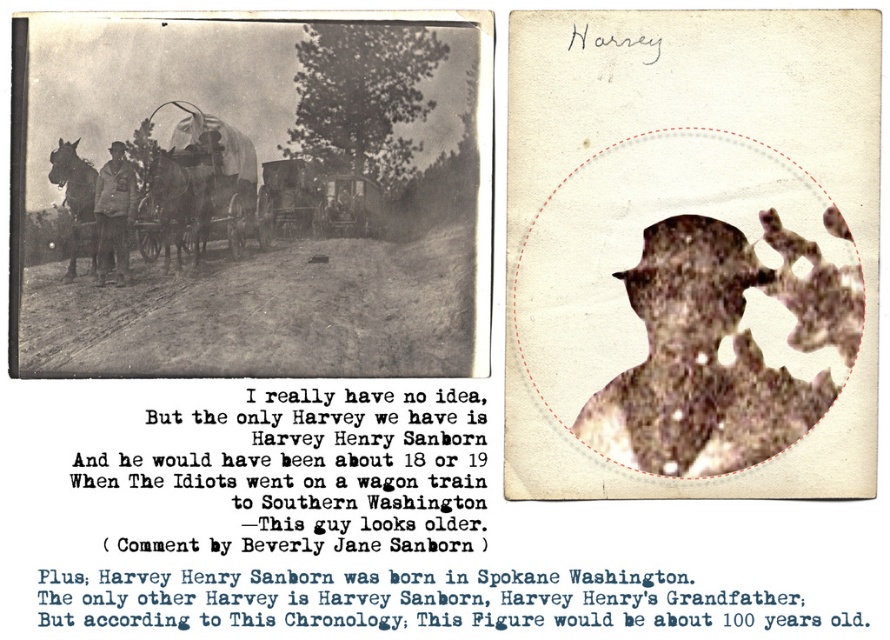
You are a person with a height of 1.7 meters. You are standing in front of the collage and see the brown paper silhouette at center. Can you touch the silhouette without moving your arms? Please explain your reasoning.

The brown paper silhouette at center is 1.21 meters away from the viewer. Since the average arm length of a person is about 0.7 meters, and the distance to the silhouette is greater than the arm length, you cannot reach it without moving closer or extending your arms beyond their normal range.

You are an art curator examining the collage. You notice the brown paper silhouette at center and the matte brown leather jacket at center. Which object appears nearer to you in the artwork?

The brown paper silhouette at center is closer to the viewer than the matte brown leather jacket at center, so the silhouette appears nearer.

You are an interior designer planning to place a brown paper silhouette at center and a matte brown leather jacket at center in a room. The room has a 2 meter wide doorway. Can you fit both items side by side through the doorway without rotating them?

The distance between the brown paper silhouette at center and the matte brown leather jacket at center is 65.57 centimeters. Since the doorway is 2 meters wide, which is 200 centimeters, there is sufficient space to fit both items side by side without rotating them.